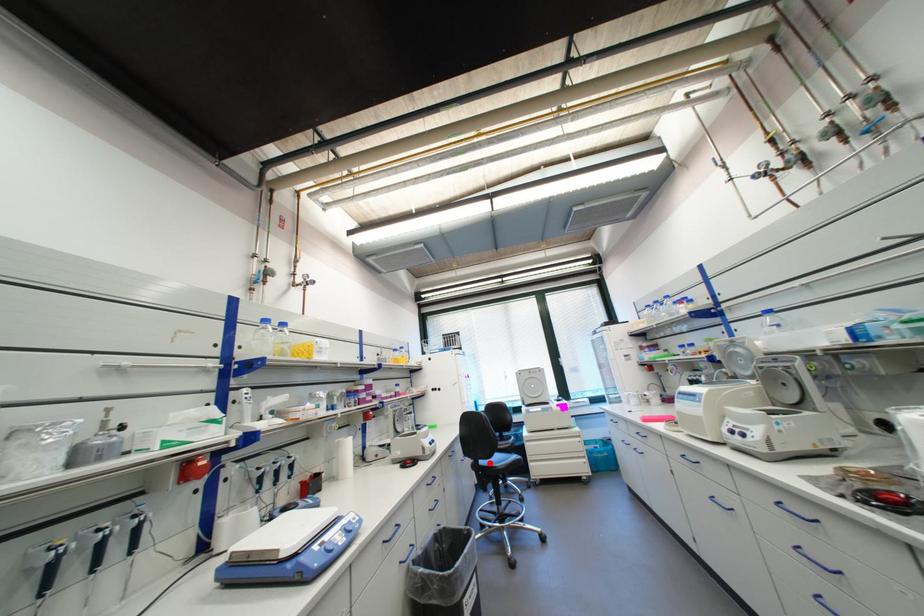
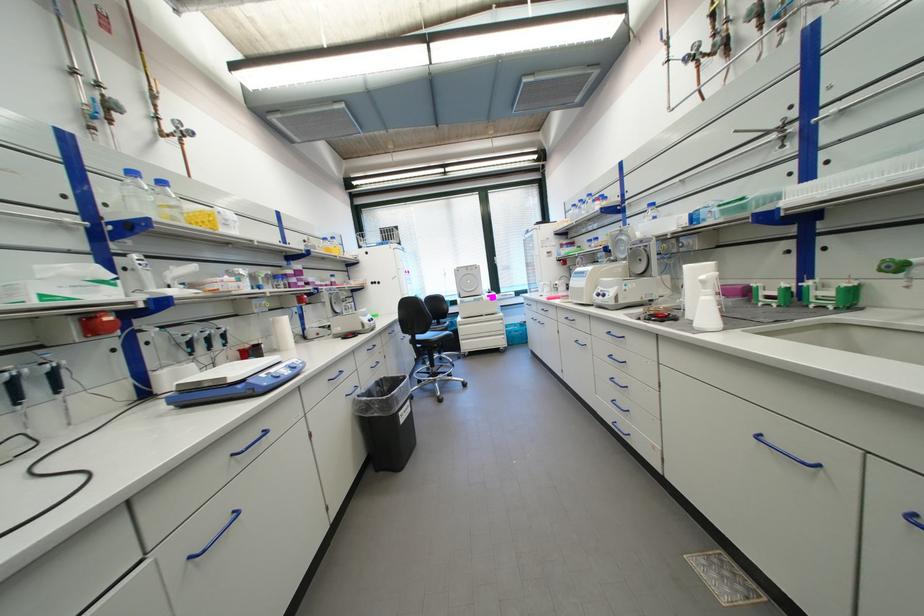
Question: I am providing you with two images of the same scene from different viewpoints. Image1 has a red point marked. In image2, the corresponding 3D location appears at what relative position? Reply with the corresponding letter.

Choices:
 (A) Closer
 (B) Farther

Answer: (A)